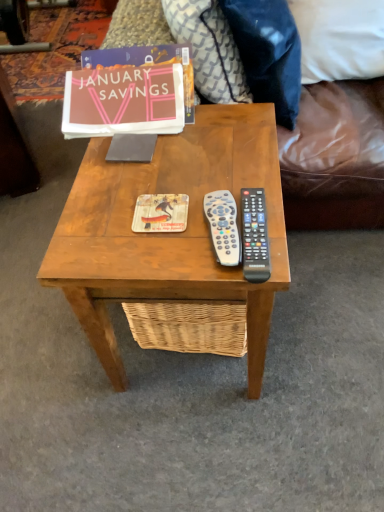
Identify the location of vacant area situated to the left side of black plastic remote at center right, arranged as the first remote control when viewed from the right. (161, 233).